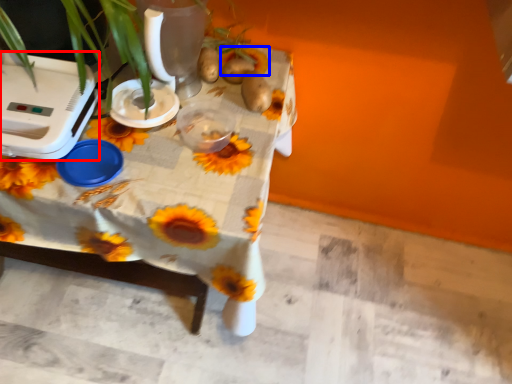
Question: Which object is closer to the camera taking this photo, appliance (highlighted by a red box) or flower (highlighted by a blue box)?

Choices:
 (A) appliance
 (B) flower

Answer: (A)